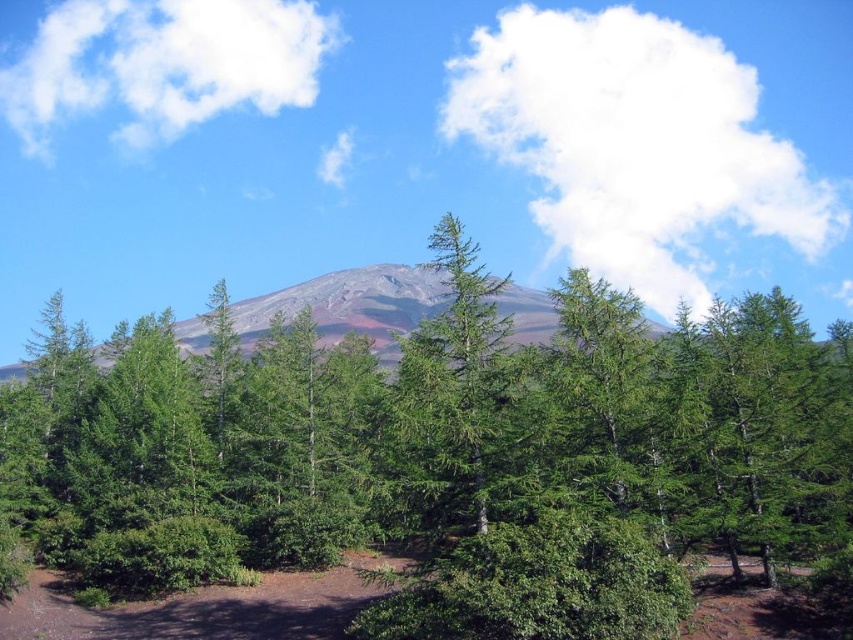
Can you confirm if green leafy trees at center is wider than green matte tree at center?

Correct, the width of green leafy trees at center exceeds that of green matte tree at center.

Image resolution: width=853 pixels, height=640 pixels. What are the coordinates of `green leafy trees at center` in the screenshot? It's located at (444, 456).

What do you see at coordinates (444, 456) in the screenshot?
I see `green leafy trees at center` at bounding box center [444, 456].

In order to click on green leafy trees at center in this screenshot , I will do `click(444, 456)`.

Does green matte tree at center appear over matte gray mountain at center?

Result: Yes, green matte tree at center is above matte gray mountain at center.

Measure the distance between green matte tree at center and camera.

green matte tree at center and camera are 86.67 feet apart.

The height and width of the screenshot is (640, 853). Find the location of `green matte tree at center`. green matte tree at center is located at coordinates (457, 385).

Is green leafy trees at center to the right of matte gray mountain at center from the viewer's perspective?

Yes, green leafy trees at center is to the right of matte gray mountain at center.

Between point (581, 314) and point (10, 369), which one is positioned behind?

The point (10, 369) is more distant.

Is point (546, 435) in front of point (550, 301)?

Yes, it is.

I want to click on green leafy trees at center, so click(444, 456).